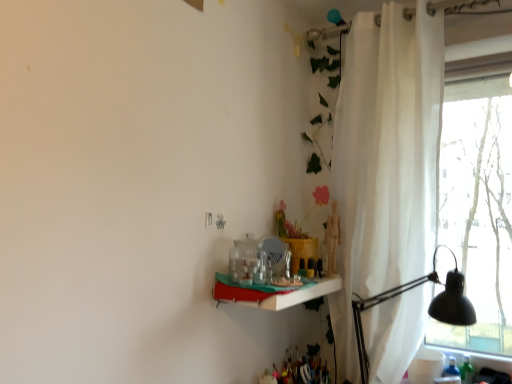
Question: Is white glossy shelf at center positioned in front of black metal table lamp at right?

Choices:
 (A) no
 (B) yes

Answer: (B)

Question: Is white glossy shelf at center wider than black metal table lamp at right?

Choices:
 (A) no
 (B) yes

Answer: (A)

Question: Can you confirm if white glossy shelf at center is smaller than black metal table lamp at right?

Choices:
 (A) yes
 (B) no

Answer: (A)

Question: Is white glossy shelf at center positioned beyond the bounds of black metal table lamp at right?

Choices:
 (A) yes
 (B) no

Answer: (A)

Question: Can you confirm if white glossy shelf at center is thinner than black metal table lamp at right?

Choices:
 (A) yes
 (B) no

Answer: (A)

Question: Is white glossy shelf at center at the right side of black metal table lamp at right?

Choices:
 (A) no
 (B) yes

Answer: (A)

Question: From a real-world perspective, is white sheer curtain at right positioned under black metal table lamp at right based on gravity?

Choices:
 (A) no
 (B) yes

Answer: (A)

Question: Is white sheer curtain at right oriented away from black metal table lamp at right?

Choices:
 (A) yes
 (B) no

Answer: (A)

Question: Can you confirm if white sheer curtain at right is taller than black metal table lamp at right?

Choices:
 (A) yes
 (B) no

Answer: (A)

Question: Is white sheer curtain at right behind black metal table lamp at right?

Choices:
 (A) no
 (B) yes

Answer: (B)

Question: Can you confirm if white sheer curtain at right is bigger than black metal table lamp at right?

Choices:
 (A) yes
 (B) no

Answer: (A)

Question: From the image's perspective, is white sheer curtain at right beneath black metal table lamp at right?

Choices:
 (A) no
 (B) yes

Answer: (A)

Question: Can you confirm if white sheer curtain at right is smaller than white glossy shelf at center?

Choices:
 (A) no
 (B) yes

Answer: (A)